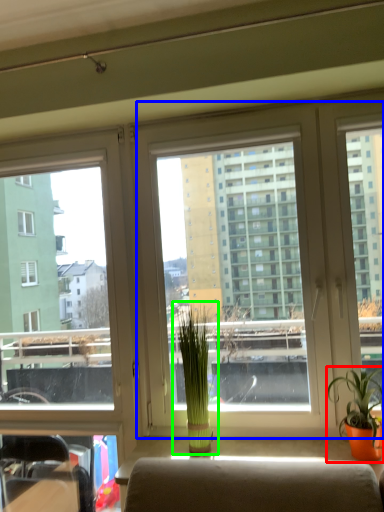
Question: Based on their relative distances, which object is nearer to houseplant (highlighted by a red box)? Choose from window screen (highlighted by a blue box) and houseplant (highlighted by a green box).

Choices:
 (A) window screen
 (B) houseplant

Answer: (A)